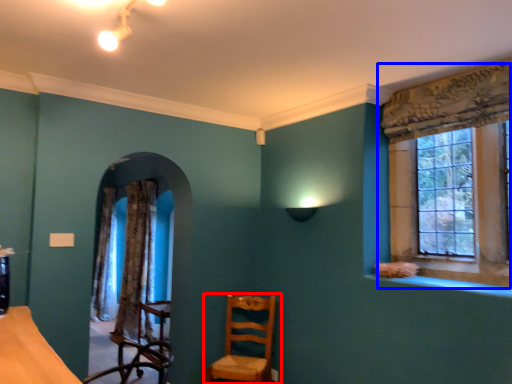
Question: Which object is closer to the camera taking this photo, chair (highlighted by a red box) or window (highlighted by a blue box)?

Choices:
 (A) chair
 (B) window

Answer: (B)